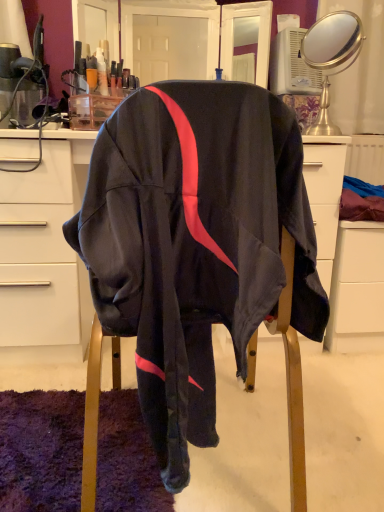
Question: Can you confirm if gold metallic mirror at upper right is positioned to the left of matte white desk at center?

Choices:
 (A) yes
 (B) no

Answer: (B)

Question: From the image's perspective, is gold metallic mirror at upper right below matte white desk at center?

Choices:
 (A) no
 (B) yes

Answer: (A)

Question: Does gold metallic mirror at upper right have a lesser height compared to matte white desk at center?

Choices:
 (A) no
 (B) yes

Answer: (B)

Question: Could you tell me if gold metallic mirror at upper right is facing matte white desk at center?

Choices:
 (A) no
 (B) yes

Answer: (A)

Question: Is gold metallic mirror at upper right taller than matte white desk at center?

Choices:
 (A) no
 (B) yes

Answer: (A)

Question: Looking at their shapes, would you say gold metallic mirror at upper right is wider or thinner than white matte file cabinet at lower right?

Choices:
 (A) thin
 (B) wide

Answer: (A)

Question: Considering the positions of gold metallic mirror at upper right and white matte file cabinet at lower right in the image, is gold metallic mirror at upper right bigger or smaller than white matte file cabinet at lower right?

Choices:
 (A) big
 (B) small

Answer: (B)

Question: From the image's perspective, is gold metallic mirror at upper right above or below white matte file cabinet at lower right?

Choices:
 (A) above
 (B) below

Answer: (A)

Question: Based on their positions, is gold metallic mirror at upper right located to the left or right of white matte file cabinet at lower right?

Choices:
 (A) left
 (B) right

Answer: (A)

Question: In terms of height, does white matte file cabinet at lower right look taller or shorter compared to gold metallic mirror at upper right?

Choices:
 (A) tall
 (B) short

Answer: (A)

Question: Based on their sizes in the image, would you say white matte file cabinet at lower right is bigger or smaller than gold metallic mirror at upper right?

Choices:
 (A) small
 (B) big

Answer: (B)

Question: In terms of width, does white matte file cabinet at lower right look wider or thinner when compared to gold metallic mirror at upper right?

Choices:
 (A) thin
 (B) wide

Answer: (B)

Question: Is point (349, 254) positioned closer to the camera than point (309, 61)?

Choices:
 (A) closer
 (B) farther

Answer: (A)

Question: Relative to matte white desk at center, is gold metallic mirror at upper right in front or behind?

Choices:
 (A) front
 (B) behind

Answer: (B)

Question: Is gold metallic mirror at upper right situated inside matte white desk at center or outside?

Choices:
 (A) inside
 (B) outside

Answer: (B)